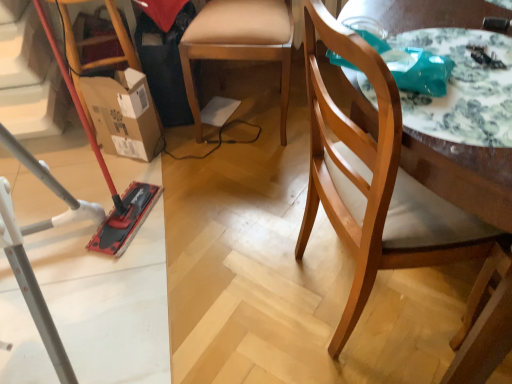
Where is `white glossy table at upper right`? The image size is (512, 384). white glossy table at upper right is located at coordinates (462, 174).

At what (x,y) coordinates should I click in order to perform the action: click on brushed metal vacuum cleaner at left. Please return your answer as a coordinate pair (x, y). Image resolution: width=512 pixels, height=384 pixels. Looking at the image, I should click on (30, 80).

This screenshot has width=512, height=384. What do you see at coordinates (123, 114) in the screenshot? I see `cardboard box at left` at bounding box center [123, 114].

Where is `white glossy table at upper right`? This screenshot has height=384, width=512. white glossy table at upper right is located at coordinates (462, 174).

From the image's perspective, is cardboard box at left located above or below light brown wooden chair at center, the 2th chair in the front-to-back sequence?

cardboard box at left is situated lower than light brown wooden chair at center, the 2th chair in the front-to-back sequence, in the image.

From a real-world perspective, which chair is the 1st one above the cardboard box at left? Please provide its 2D coordinates.

[(237, 49)]

Does point (96, 92) lie in front of point (209, 56)?

No, (96, 92) is further to viewer.

From a real-world perspective, is cardboard box at left physically above light brown wooden chair at center, the 2th chair in the front-to-back sequence?

No, from a real-world perspective, cardboard box at left is not over light brown wooden chair at center, the 2th chair in the front-to-back sequence

Would you say cardboard box at left is part of wooden chair at right, which is the first chair from front to back,'s contents?

That's incorrect, cardboard box at left is not inside wooden chair at right, which is the first chair from front to back.

Is wooden chair at right, the 2th chair when ordered from back to front, in front of or behind cardboard box at left in the image?

Visually, wooden chair at right, the 2th chair when ordered from back to front, is located in front of cardboard box at left.

From the image's perspective, is wooden chair at right, which is the first chair from front to back, above cardboard box at left?

No, from the image's perspective, wooden chair at right, which is the first chair from front to back, is not over cardboard box at left.

From the picture: Is wooden chair at right, the 2th chair when ordered from back to front, at the right side of cardboard box at left?

Yes, wooden chair at right, the 2th chair when ordered from back to front, is to the right of cardboard box at left.

Measure the distance from brushed metal vacuum cleaner at left to light brown wooden chair at center, arranged as the 1th chair when viewed from the back.

brushed metal vacuum cleaner at left and light brown wooden chair at center, arranged as the 1th chair when viewed from the back, are 68.43 centimeters apart from each other.

Which of these two, brushed metal vacuum cleaner at left or light brown wooden chair at center, the 2th chair in the front-to-back sequence, is smaller?

Smaller between the two is brushed metal vacuum cleaner at left.

In terms of width, does brushed metal vacuum cleaner at left look wider or thinner when compared to light brown wooden chair at center, the 2th chair in the front-to-back sequence?

In the image, brushed metal vacuum cleaner at left appears to be wider than light brown wooden chair at center, the 2th chair in the front-to-back sequence.

From the picture: From their relative heights in the image, would you say brushed metal vacuum cleaner at left is taller or shorter than light brown wooden chair at center, the 2th chair in the front-to-back sequence?

brushed metal vacuum cleaner at left is taller than light brown wooden chair at center, the 2th chair in the front-to-back sequence.

Find the location of a particular element. cardboard box on the left of the white glossy table at upper right is located at coordinates (123, 114).

Which object is thinner, cardboard box at left or white glossy table at upper right?

Thinner between the two is cardboard box at left.

Which object is positioned more to the right, cardboard box at left or white glossy table at upper right?

From the viewer's perspective, white glossy table at upper right appears more on the right side.

Which is behind, point (116, 119) or point (442, 171)?

The point (116, 119) is farther from the camera.

Looking at the image, does white glossy table at upper right seem bigger or smaller compared to wooden chair at right, which is the first chair from front to back?

Clearly, white glossy table at upper right is smaller in size than wooden chair at right, which is the first chair from front to back.

From the image's perspective, who appears lower, white glossy table at upper right or wooden chair at right, which is the first chair from front to back?

wooden chair at right, which is the first chair from front to back.

Considering the relative positions of white glossy table at upper right and wooden chair at right, which is the first chair from front to back, in the image provided, is white glossy table at upper right to the right of wooden chair at right, which is the first chair from front to back, from the viewer's perspective?

Indeed, white glossy table at upper right is positioned on the right side of wooden chair at right, which is the first chair from front to back.

Based on the photo, is white glossy table at upper right positioned beyond the bounds of wooden chair at right, which is the first chair from front to back?

No, most part of white glossy table at upper right lies within wooden chair at right, which is the first chair from front to back.

Which is behind, point (29, 16) or point (505, 208)?

The point (29, 16) is farther from the camera.

At what (x,y) coordinates should I click in order to perform the action: click on stairwell above the white glossy table at upper right (from the image's perspective). Please return your answer as a coordinate pair (x, y). This screenshot has width=512, height=384. Looking at the image, I should click on (30, 80).

Consider the image. Does brushed metal vacuum cleaner at left touch white glossy table at upper right?

No.

Which of these two, brushed metal vacuum cleaner at left or white glossy table at upper right, stands shorter?

white glossy table at upper right.

Based on the photo, is white glossy table at upper right completely or partially inside light brown wooden chair at center, the 2th chair in the front-to-back sequence?

Definitely not — white glossy table at upper right is not inside light brown wooden chair at center, the 2th chair in the front-to-back sequence.

Does point (267, 35) come farther from viewer compared to point (477, 150)?

Yes, it is.

Based on the photo, does light brown wooden chair at center, arranged as the 1th chair when viewed from the back, have a greater width compared to white glossy table at upper right?

Yes.

You are a GUI agent. You are given a task and a screenshot of the screen. Output one action in this format:
    pyautogui.click(x=<x>, y=<y>)
    Task: Click on the cardboard box on the left of light brown wooden chair at center, the 2th chair in the front-to-back sequence
    This screenshot has width=512, height=384.
    Given the screenshot: What is the action you would take?
    point(123,114)

From the cardboard box at left, count 2nd chair to the right and point to it. Please provide its 2D coordinates.

[(387, 181)]

Based on their spatial positions, is wooden chair at right, the 2th chair when ordered from back to front, or cardboard box at left closer to brushed metal vacuum cleaner at left?

Among the two, cardboard box at left is located nearer to brushed metal vacuum cleaner at left.

Considering their positions, is light brown wooden chair at center, the 2th chair in the front-to-back sequence, positioned further to wooden chair at right, the 2th chair when ordered from back to front, than brushed metal vacuum cleaner at left?

Among the two, brushed metal vacuum cleaner at left is located further to wooden chair at right, the 2th chair when ordered from back to front.

Estimate the real-world distances between objects in this image. Which object is closer to brushed metal vacuum cleaner at left, cardboard box at left or wooden chair at right, which is the first chair from front to back?

cardboard box at left.

Based on their spatial positions, is white glossy table at upper right or cardboard box at left closer to light brown wooden chair at center, the 2th chair in the front-to-back sequence?

The object closer to light brown wooden chair at center, the 2th chair in the front-to-back sequence, is cardboard box at left.

Considering their positions, is brushed metal vacuum cleaner at left positioned closer to white glossy table at upper right than cardboard box at left?

Based on the image, cardboard box at left appears to be nearer to white glossy table at upper right.

Which object lies nearer to the anchor point light brown wooden chair at center, the 2th chair in the front-to-back sequence, cardboard box at left or brushed metal vacuum cleaner at left?

Among the two, cardboard box at left is located nearer to light brown wooden chair at center, the 2th chair in the front-to-back sequence.

When comparing their distances from brushed metal vacuum cleaner at left, does light brown wooden chair at center, the 2th chair in the front-to-back sequence, or white glossy table at upper right seem further?

white glossy table at upper right is positioned further to the anchor brushed metal vacuum cleaner at left.

Looking at this image, estimate the real-world distances between objects in this image. Which object is closer to cardboard box at left, light brown wooden chair at center, the 2th chair in the front-to-back sequence, or wooden chair at right, which is the first chair from front to back?

Based on the image, light brown wooden chair at center, the 2th chair in the front-to-back sequence, appears to be nearer to cardboard box at left.

Find the location of `chair positioned between white glossy table at upper right and cardboard box at left from near to far`. chair positioned between white glossy table at upper right and cardboard box at left from near to far is located at coordinates (237, 49).

Locate an element on the screen. The image size is (512, 384). round table between wooden chair at right, which is the first chair from front to back, and cardboard box at left from front to back is located at coordinates (462, 174).

The width and height of the screenshot is (512, 384). Find the location of `chair situated between brushed metal vacuum cleaner at left and wooden chair at right, the 2th chair when ordered from back to front, from left to right`. chair situated between brushed metal vacuum cleaner at left and wooden chair at right, the 2th chair when ordered from back to front, from left to right is located at coordinates (237, 49).

The image size is (512, 384). What are the coordinates of `cardboard box between brushed metal vacuum cleaner at left and wooden chair at right, which is the first chair from front to back` in the screenshot? It's located at [x=123, y=114].